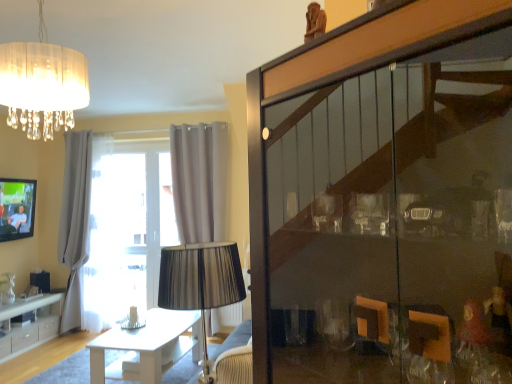
Question: Is matte black tv at left far away from white sheer curtain at left, marked as the 2th curtain in a right-to-left arrangement?

Choices:
 (A) yes
 (B) no

Answer: (B)

Question: Does matte black tv at left have a lesser width compared to white sheer curtain at left, the 1th curtain in the left-to-right sequence?

Choices:
 (A) no
 (B) yes

Answer: (B)

Question: From a real-world perspective, is matte black tv at left physically above white sheer curtain at left, marked as the 2th curtain in a right-to-left arrangement?

Choices:
 (A) no
 (B) yes

Answer: (B)

Question: Is matte black tv at left taller than white sheer curtain at left, marked as the 2th curtain in a right-to-left arrangement?

Choices:
 (A) yes
 (B) no

Answer: (B)

Question: Can you confirm if matte black tv at left is shorter than white sheer curtain at left, marked as the 2th curtain in a right-to-left arrangement?

Choices:
 (A) yes
 (B) no

Answer: (A)

Question: Is white sheer curtain at left, the 1th curtain in the left-to-right sequence, taller or shorter than white glossy table at center?

Choices:
 (A) tall
 (B) short

Answer: (A)

Question: Is white sheer curtain at left, marked as the 2th curtain in a right-to-left arrangement, inside the boundaries of white glossy table at center, or outside?

Choices:
 (A) outside
 (B) inside

Answer: (A)

Question: From the image's perspective, is white sheer curtain at left, marked as the 2th curtain in a right-to-left arrangement, positioned above or below white glossy table at center?

Choices:
 (A) above
 (B) below

Answer: (A)

Question: Considering the relative positions of white sheer curtain at left, the 1th curtain in the left-to-right sequence, and white glossy table at center in the image provided, is white sheer curtain at left, the 1th curtain in the left-to-right sequence, to the left or to the right of white glossy table at center?

Choices:
 (A) left
 (B) right

Answer: (A)

Question: Do you think clear glass vase at lower left is within white sheer curtain at left, the 1th curtain in the left-to-right sequence, or outside of it?

Choices:
 (A) outside
 (B) inside

Answer: (A)

Question: Is clear glass vase at lower left taller or shorter than white sheer curtain at left, the 1th curtain in the left-to-right sequence?

Choices:
 (A) tall
 (B) short

Answer: (B)

Question: Looking at their shapes, would you say clear glass vase at lower left is wider or thinner than white sheer curtain at left, the 1th curtain in the left-to-right sequence?

Choices:
 (A) wide
 (B) thin

Answer: (B)

Question: Is clear glass vase at lower left in front of or behind white sheer curtain at left, marked as the 2th curtain in a right-to-left arrangement, in the image?

Choices:
 (A) front
 (B) behind

Answer: (A)

Question: In terms of size, does white glossy cabinet at lower left appear bigger or smaller than matte black tv at left?

Choices:
 (A) small
 (B) big

Answer: (B)

Question: From a real-world perspective, relative to matte black tv at left, is white glossy cabinet at lower left vertically above or below?

Choices:
 (A) below
 (B) above

Answer: (A)